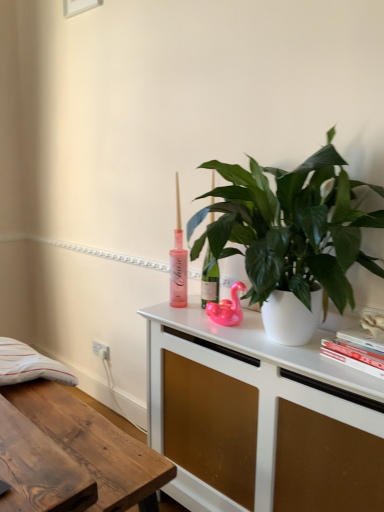
This screenshot has height=512, width=384. I want to click on free space that is to the left of hardcover book at right, so tap(308, 355).